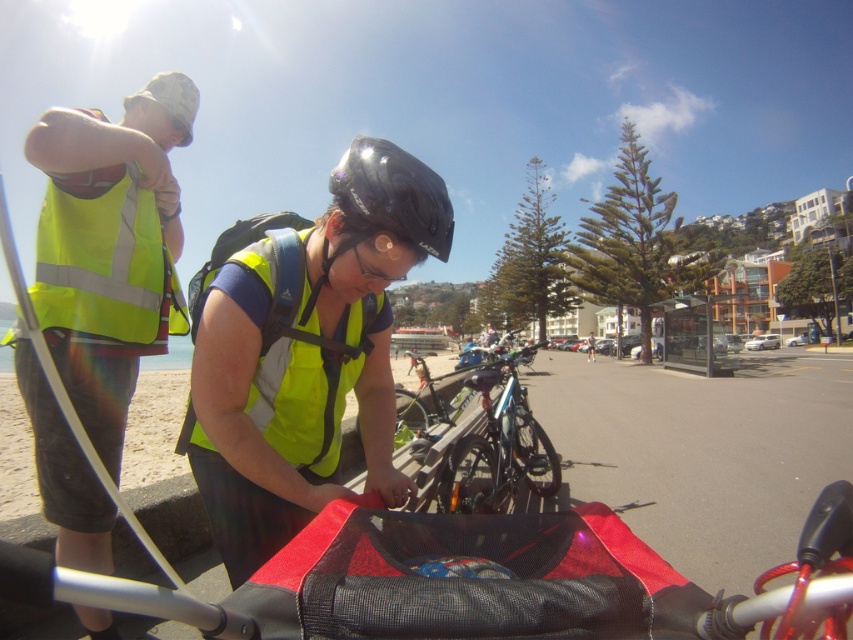
I want to click on high visibility yellow vest at left, so click(x=109, y=248).

Is high visibility yellow vest at left smaller than yellow reflective safety vest at upper left?

No.

I want to click on high visibility yellow vest at left, so click(109, 248).

Is high-visibility yellow vest at center to the left of glossy black helmet at center from the viewer's perspective?

In fact, high-visibility yellow vest at center is to the right of glossy black helmet at center.

Can you confirm if high-visibility yellow vest at center is shorter than glossy black helmet at center?

Correct, high-visibility yellow vest at center is not as tall as glossy black helmet at center.

Is point (380, 483) in front of point (438, 179)?

No, (380, 483) is behind (438, 179).

Where is `high-visibility yellow vest at center`? high-visibility yellow vest at center is located at coordinates (306, 355).

Does shiny blue bike at center have a lesser height compared to glossy black helmet at center?

Correct, shiny blue bike at center is not as tall as glossy black helmet at center.

Who is more distant from viewer, (531, 352) or (344, 196)?

Positioned behind is point (531, 352).

Image resolution: width=853 pixels, height=640 pixels. I want to click on shiny blue bike at center, so click(500, 445).

I want to click on shiny blue bike at center, so click(x=500, y=445).